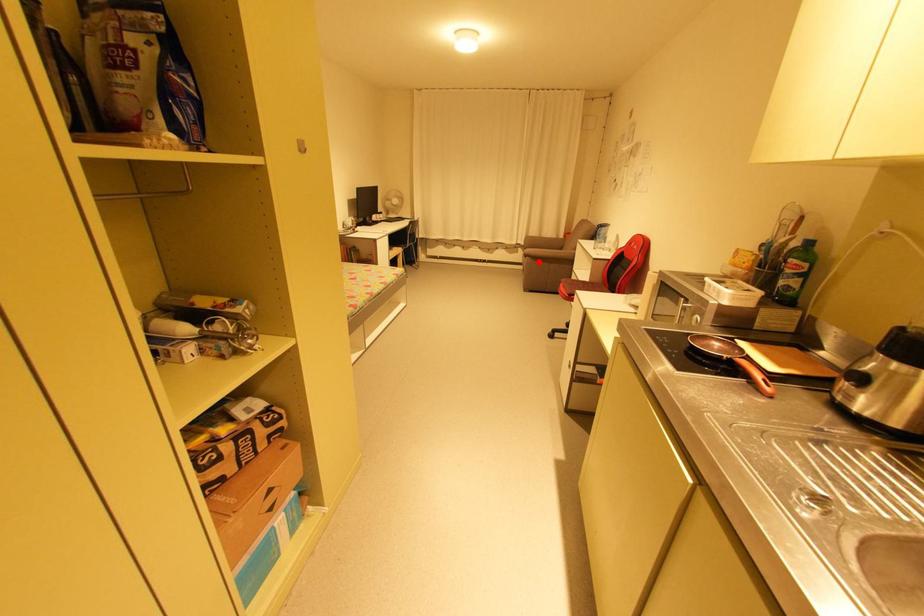
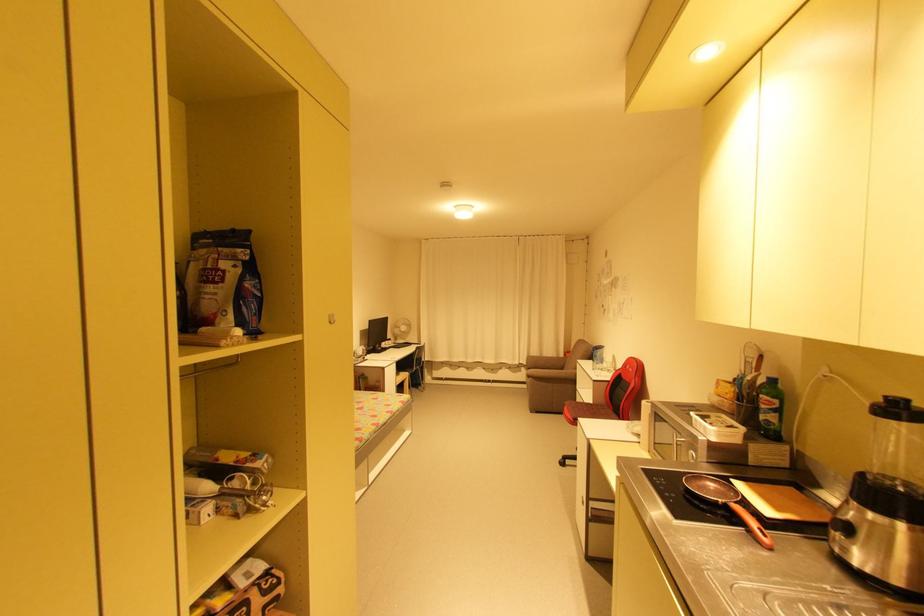
Question: I am providing you with two images of the same scene from different viewpoints. Image1 has a red point marked. In image2, the corresponding 3D location appears at what relative position? Reply with the corresponding letter.

Choices:
 (A) Closer
 (B) Farther

Answer: (B)